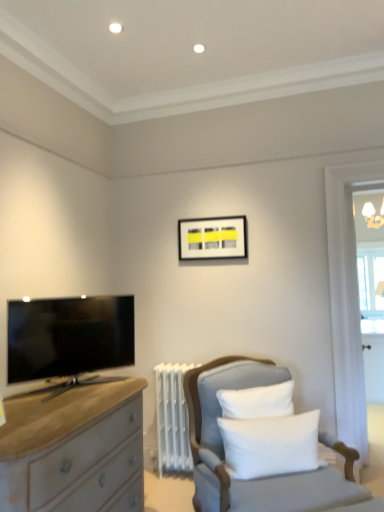
In order to face matte black picture frame at upper center, should I rotate leftwards or rightwards?

Turn right approximately 2.977 degrees to face it.

This screenshot has width=384, height=512. Find the location of `light gray fabric chair at lower right`. light gray fabric chair at lower right is located at coordinates (224, 451).

How far apart are light gray fabric chair at lower right and matte black tv at left?

A distance of 30.79 inches exists between light gray fabric chair at lower right and matte black tv at left.

Is light gray fabric chair at lower right facing towards matte black tv at left?

No, light gray fabric chair at lower right is not facing towards matte black tv at left.

Can you confirm if light gray fabric chair at lower right is positioned to the left of matte black tv at left?

No.

Considering the sizes of objects light gray fabric chair at lower right and matte black tv at left in the image provided, who is thinner, light gray fabric chair at lower right or matte black tv at left?

With smaller width is matte black tv at left.

How many degrees apart are the facing directions of matte black tv at left and matte black picture frame at upper center?

The angular difference between matte black tv at left and matte black picture frame at upper center is 52.9 degrees.

Does matte black tv at left have a larger size compared to matte black picture frame at upper center?

Indeed, matte black tv at left has a larger size compared to matte black picture frame at upper center.

Can you confirm if matte black tv at left is positioned to the right of matte black picture frame at upper center?

Incorrect, matte black tv at left is not on the right side of matte black picture frame at upper center.

Which point is more forward, (13,326) or (224,246)?

The point (13,326) is closer to the camera.

Measure the distance from matte black picture frame at upper center to clear glass window at right.

matte black picture frame at upper center is 1.10 meters from clear glass window at right.

Considering the sizes of objects matte black picture frame at upper center and clear glass window at right in the image provided, who is wider, matte black picture frame at upper center or clear glass window at right?

clear glass window at right.

Is matte black picture frame at upper center not near clear glass window at right?

Yes, matte black picture frame at upper center and clear glass window at right are quite far apart.

What's the angular difference between matte black picture frame at upper center and clear glass window at right's facing directions?

The facing directions of matte black picture frame at upper center and clear glass window at right are 0.632 degrees apart.

Is matte black picture frame at upper center not inside white soft cushion at center?

Absolutely, matte black picture frame at upper center is external to white soft cushion at center.

Who is bigger, matte black picture frame at upper center or white soft cushion at center?

white soft cushion at center is bigger.

Is matte black picture frame at upper center touching white soft cushion at center?

No, matte black picture frame at upper center is not with white soft cushion at center.

Is matte black picture frame at upper center thinner than white soft cushion at center?

Indeed, matte black picture frame at upper center has a lesser width compared to white soft cushion at center.

Locate an element on the screen. The width and height of the screenshot is (384, 512). window screen behind the matte black picture frame at upper center is located at coordinates (371, 286).

Consider the image. In the image, is clear glass window at right on the left side or the right side of matte black picture frame at upper center?

clear glass window at right is positioned on matte black picture frame at upper center's right side.

From a real-world perspective, is clear glass window at right positioned over matte black picture frame at upper center based on gravity?

Actually, clear glass window at right is physically below matte black picture frame at upper center in the real world.

Is matte black picture frame at upper center at the back of clear glass window at right?

No, clear glass window at right is not facing away from matte black picture frame at upper center.

From a real-world perspective, which is physically below, matte black picture frame at upper center or matte black tv at left?

From a 3D spatial view, matte black tv at left is below.

Which is closer, (228, 245) or (71, 344)?

Point (228, 245) is farther from the camera than point (71, 344).

Is matte black picture frame at upper center wider or thinner than matte black tv at left?

Clearly, matte black picture frame at upper center has less width compared to matte black tv at left.

Considering the sizes of objects matte black picture frame at upper center and matte black tv at left in the image provided, who is shorter, matte black picture frame at upper center or matte black tv at left?

With less height is matte black picture frame at upper center.

Considering the relative sizes of clear glass window at right and light gray fabric chair at lower right in the image provided, is clear glass window at right smaller than light gray fabric chair at lower right?

Yes.

From the image's perspective, between clear glass window at right and light gray fabric chair at lower right, who is located below?

light gray fabric chair at lower right is shown below in the image.

Is clear glass window at right at the left side of light gray fabric chair at lower right?

Incorrect, clear glass window at right is not on the left side of light gray fabric chair at lower right.

Measure the distance between clear glass window at right and light gray fabric chair at lower right.

The distance of clear glass window at right from light gray fabric chair at lower right is 1.54 meters.

Locate an element on the screen. chair that appears on the right of matte black tv at left is located at coordinates point(224,451).

The image size is (384, 512). Identify the location of picture frame above the matte black tv at left (from a real-world perspective). (212, 238).

Estimate the real-world distances between objects in this image. Which object is further from matte black picture frame at upper center, matte black tv at left or light gray fabric chair at lower right?

light gray fabric chair at lower right lies further to matte black picture frame at upper center than the other object.

Which object lies further to the anchor point white soft cushion at center, light gray fabric chair at lower right or matte black picture frame at upper center?

matte black picture frame at upper center is further to white soft cushion at center.

Considering their positions, is clear glass window at right positioned closer to matte black tv at left than matte black picture frame at upper center?

matte black picture frame at upper center is positioned closer to the anchor matte black tv at left.

Based on the photo, when comparing their distances from clear glass window at right, does white soft cushion at center or light gray fabric chair at lower right seem further?

white soft cushion at center is positioned further to the anchor clear glass window at right.

When comparing their distances from matte black picture frame at upper center, does clear glass window at right or white soft cushion at center seem closer?

clear glass window at right.

Considering their positions, is white soft cushion at center positioned further to matte black tv at left than matte black picture frame at upper center?

matte black picture frame at upper center is further to matte black tv at left.

Estimate the real-world distances between objects in this image. Which object is further from matte black picture frame at upper center, white soft cushion at center or light gray fabric chair at lower right?

white soft cushion at center lies further to matte black picture frame at upper center than the other object.

Looking at the image, which one is located further to white soft cushion at center, matte black tv at left or light gray fabric chair at lower right?

matte black tv at left is positioned further to the anchor white soft cushion at center.

I want to click on television located between white soft cushion at center and clear glass window at right in the depth direction, so click(x=69, y=336).

Find the location of a particular element. The height and width of the screenshot is (512, 384). chair between matte black tv at left and white soft cushion at center from left to right is located at coordinates (224, 451).

Locate an element on the screen. This screenshot has width=384, height=512. television between light gray fabric chair at lower right and matte black picture frame at upper center from front to back is located at coordinates (69, 336).

Locate an element on the screen. Image resolution: width=384 pixels, height=512 pixels. television positioned between white soft cushion at center and matte black picture frame at upper center from near to far is located at coordinates (69, 336).